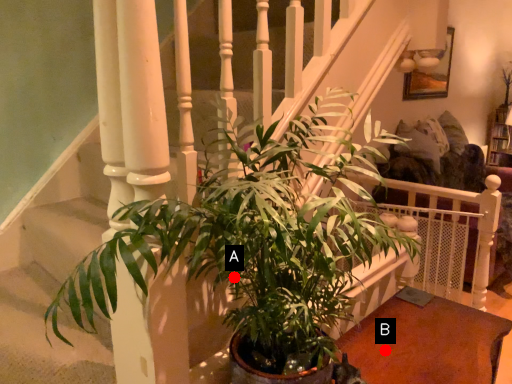
Question: Two points are circled on the image, labeled by A and B beside each circle. Which point is farther to the camera?

Choices:
 (A) A is further
 (B) B is further

Answer: (B)